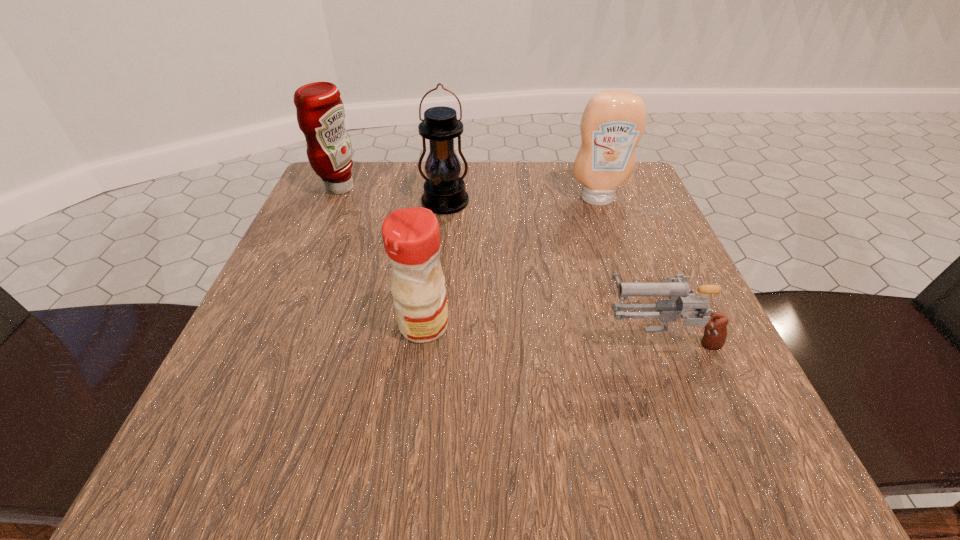
Identify the location of lantern. (444, 191).

You are a GUI agent. You are given a task and a screenshot of the screen. Output one action in this format:
    pyautogui.click(x=<x>, y=<y>)
    Task: Click on the rightmost condiment
    Image resolution: width=960 pixels, height=540 pixels.
    Given the screenshot: What is the action you would take?
    pyautogui.click(x=613, y=122)

The image size is (960, 540). In order to click on the leftmost condiment in this screenshot , I will do `click(320, 112)`.

Image resolution: width=960 pixels, height=540 pixels. Identify the location of the nearest condiment. (411, 236).

Where is `gun`? gun is located at coordinates (677, 289).

Locate some placea in vacant space located 0.120m above the lantern, indicating its light source. Please provide its 2D coordinates. Your answer should be formatted as a tuple, i.e. [(x, y)], where the tuple contains the x and y coordinates of a point satisfying the conditions above.

[(440, 255)]

Where is `vacant space located on the label of the rightmost condiment`? Image resolution: width=960 pixels, height=540 pixels. vacant space located on the label of the rightmost condiment is located at coordinates (638, 315).

Locate an element on the screen. free space located 0.280m on the right of the leftmost condiment is located at coordinates (481, 188).

Where is `free region located 0.320m on the right of the nearest condiment`? free region located 0.320m on the right of the nearest condiment is located at coordinates (649, 325).

The width and height of the screenshot is (960, 540). What are the coordinates of `free location located at the barrel end of the gun` in the screenshot? It's located at (442, 337).